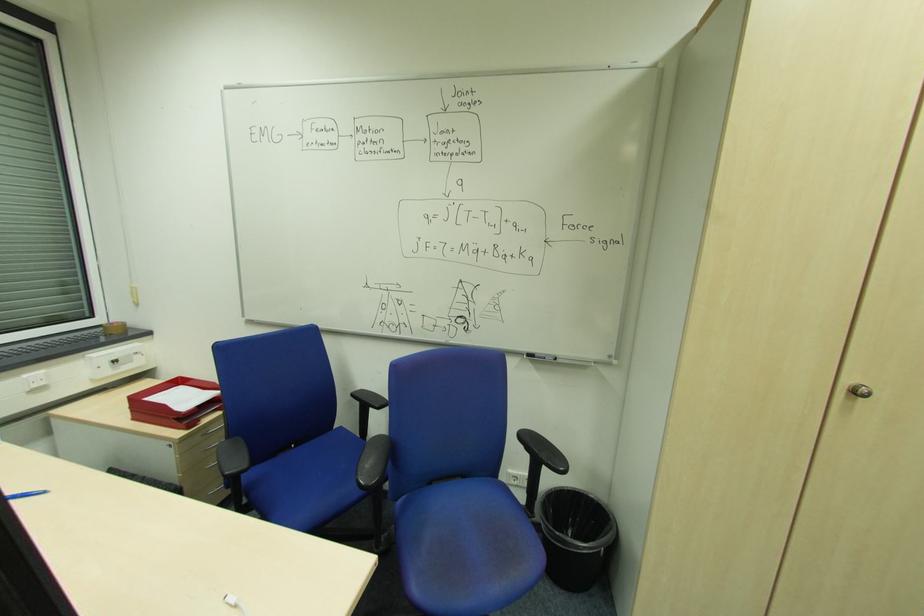
This screenshot has width=924, height=616. Find the location of `red paper tray`. red paper tray is located at coordinates (175, 402).